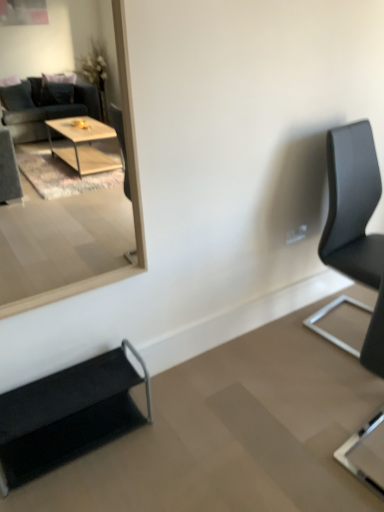
Question: Is wooden frame mirror at upper left located outside black leather chair at right, the first chair from the right?

Choices:
 (A) yes
 (B) no

Answer: (A)

Question: From the image's perspective, would you say wooden frame mirror at upper left is positioned over black leather chair at right, positioned as the third chair in left-to-right order?

Choices:
 (A) no
 (B) yes

Answer: (B)

Question: Is black leather chair at right, positioned as the third chair in left-to-right order, completely or partially inside wooden frame mirror at upper left?

Choices:
 (A) yes
 (B) no

Answer: (B)

Question: Is wooden frame mirror at upper left at the left side of black leather chair at right, the first chair from the right?

Choices:
 (A) no
 (B) yes

Answer: (B)

Question: Is the depth of wooden frame mirror at upper left less than that of black leather chair at right, positioned as the third chair in left-to-right order?

Choices:
 (A) yes
 (B) no

Answer: (A)

Question: From their relative heights in the image, would you say black leather chair at right, the 2th chair positioned from the left, is taller or shorter than black leather chair at right, the first chair from the right?

Choices:
 (A) tall
 (B) short

Answer: (A)

Question: Is point (370, 350) closer or farther from the camera than point (364, 212)?

Choices:
 (A) closer
 (B) farther

Answer: (A)

Question: Is black leather chair at right, which is counted as the second chair, starting from the right, inside the boundaries of black leather chair at right, positioned as the third chair in left-to-right order, or outside?

Choices:
 (A) outside
 (B) inside

Answer: (A)

Question: From the image's perspective, is black leather chair at right, the 2th chair positioned from the left, positioned above or below black leather chair at right, positioned as the third chair in left-to-right order?

Choices:
 (A) above
 (B) below

Answer: (B)

Question: Considering the positions of black fabric chair at lower left, the 3th chair positioned from the right, and wooden frame mirror at upper left in the image, is black fabric chair at lower left, the 3th chair positioned from the right, taller or shorter than wooden frame mirror at upper left?

Choices:
 (A) short
 (B) tall

Answer: (A)

Question: Is black fabric chair at lower left, the 3th chair positioned from the right, bigger or smaller than wooden frame mirror at upper left?

Choices:
 (A) small
 (B) big

Answer: (B)

Question: In the image, is black fabric chair at lower left, marked as the 1th chair in a left-to-right arrangement, positioned in front of or behind wooden frame mirror at upper left?

Choices:
 (A) front
 (B) behind

Answer: (B)

Question: Considering the positions of point (19, 468) and point (16, 304), is point (19, 468) closer or farther from the camera than point (16, 304)?

Choices:
 (A) farther
 (B) closer

Answer: (A)

Question: Considering the positions of wooden frame mirror at upper left and black fabric chair at lower left, the 3th chair positioned from the right, in the image, is wooden frame mirror at upper left wider or thinner than black fabric chair at lower left, the 3th chair positioned from the right,?

Choices:
 (A) wide
 (B) thin

Answer: (B)

Question: Based on their positions, is wooden frame mirror at upper left located to the left or right of black fabric chair at lower left, the 3th chair positioned from the right?

Choices:
 (A) left
 (B) right

Answer: (B)